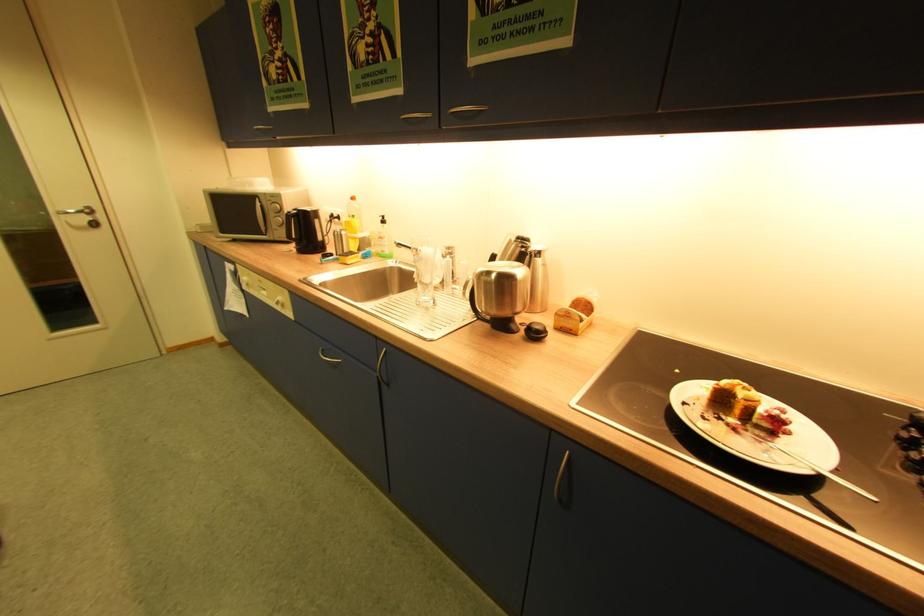
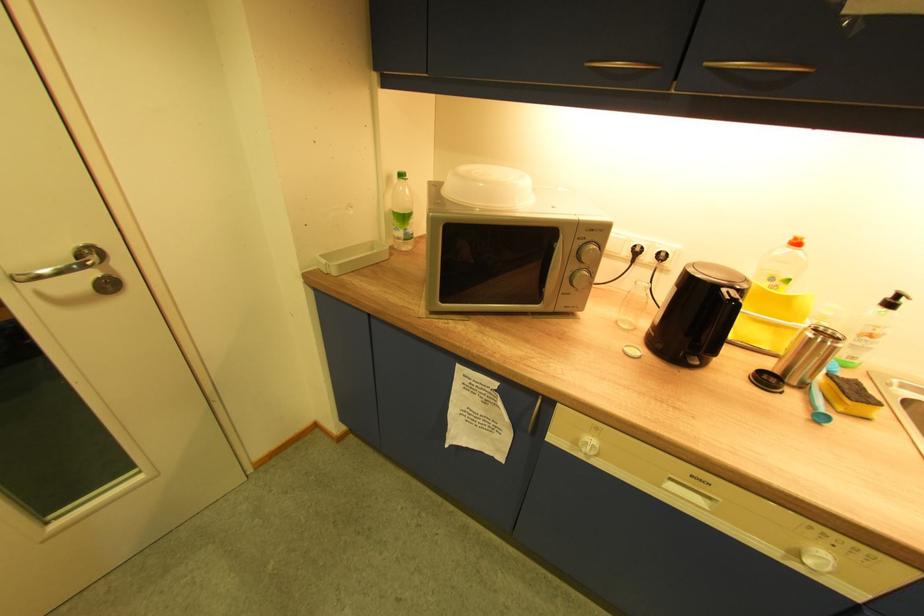
Where in the second image is the point corresponding to pixel 333 257 from the first image?

(772, 382)